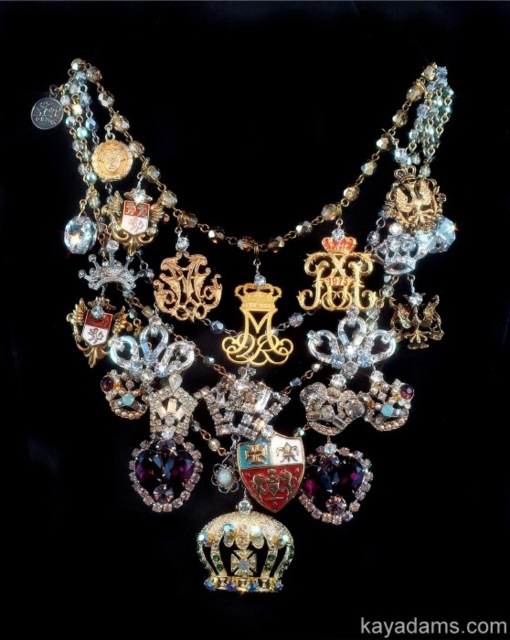
Question: Is shiny gold crown at center bigger than goldmetalliccrown at center?

Choices:
 (A) yes
 (B) no

Answer: (A)

Question: Is shiny gold crown at center to the left of goldmetalliccrown at center from the viewer's perspective?

Choices:
 (A) no
 (B) yes

Answer: (B)

Question: Among these points, which one is farthest from the camera?

Choices:
 (A) (306, 296)
 (B) (425, 317)

Answer: (A)

Question: In this image, where is shiny gold crown at center located relative to goldmetalliccrown at center?

Choices:
 (A) right
 (B) left

Answer: (B)